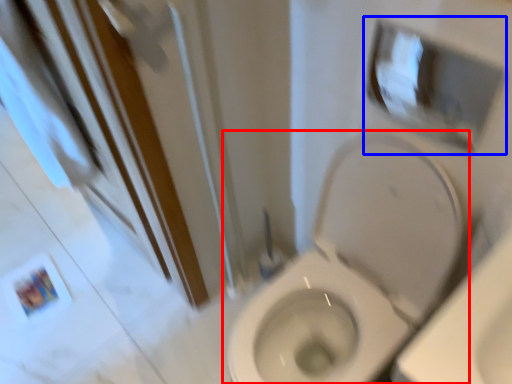
Question: Which point is closer to the camera, toilet (highlighted by a red box) or medicine cabinet (highlighted by a blue box)?

Choices:
 (A) toilet
 (B) medicine cabinet

Answer: (A)